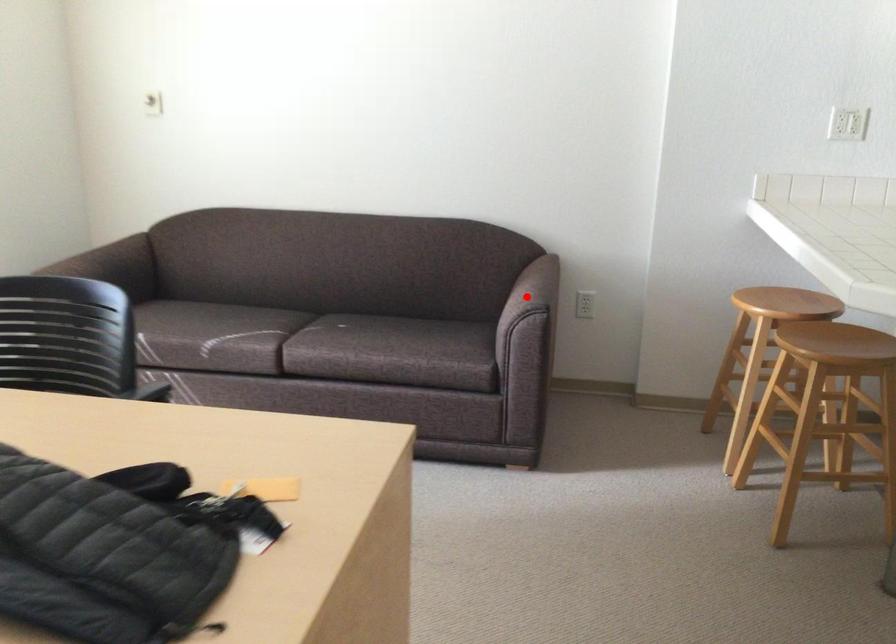
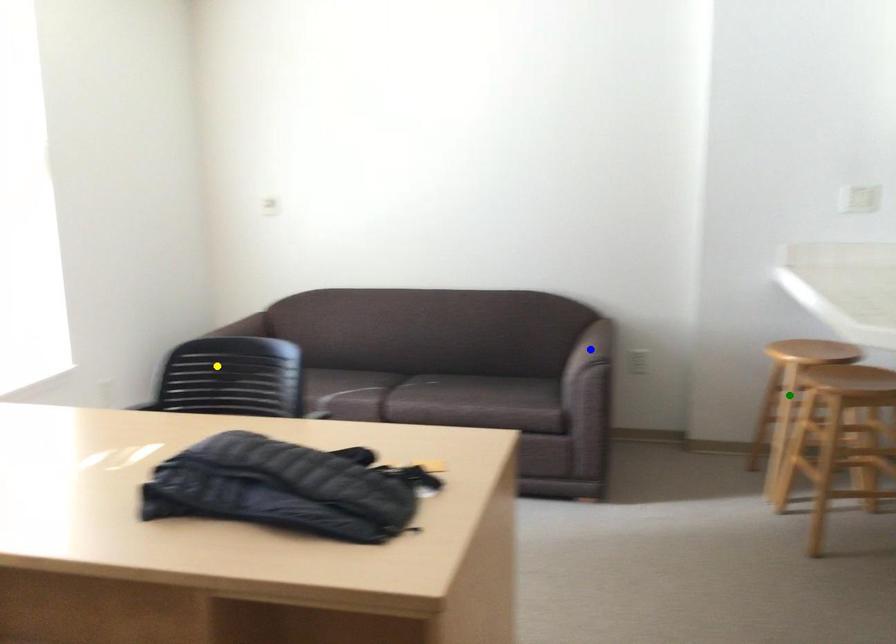
Question: I am providing you with two images of the same scene from different viewpoints. A red point is marked on the first image. You are given multiple points on the second image. Can you choose the point in image 2 that corresponds to the point in image 1?

Choices:
 (A) green point
 (B) blue point
 (C) yellow point

Answer: (B)